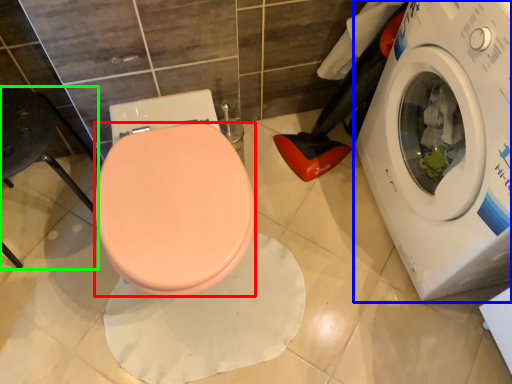
Question: Which is farther away from bidet (highlighted by a red box)? washing machine (highlighted by a blue box) or chair (highlighted by a green box)?

Choices:
 (A) washing machine
 (B) chair

Answer: (A)